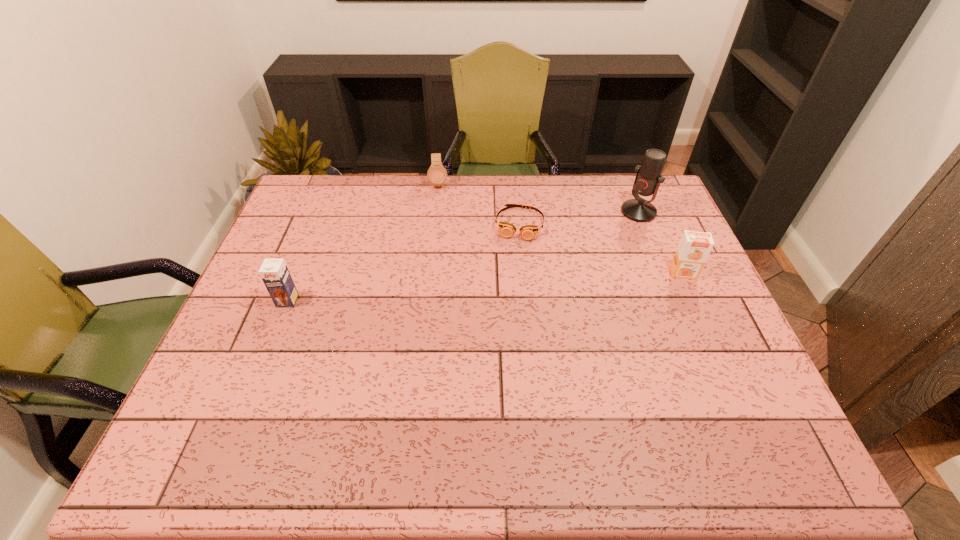
Where is `vacant space situated 0.230m on the side of the tallest object with the red ring`? The height and width of the screenshot is (540, 960). vacant space situated 0.230m on the side of the tallest object with the red ring is located at coordinates (583, 251).

The image size is (960, 540). Find the location of `free space located on the side of the tallest object with the red ring`. free space located on the side of the tallest object with the red ring is located at coordinates (570, 260).

I want to click on free space located on the side of the tallest object with the red ring, so click(606, 235).

At what (x,y) coordinates should I click in order to perform the action: click on vacant space located with the lenses facing forward on the shortest object. Please return your answer as a coordinate pair (x, y). The width and height of the screenshot is (960, 540). Looking at the image, I should click on (511, 274).

This screenshot has width=960, height=540. I want to click on vacant space located with the lenses facing forward on the shortest object, so click(x=514, y=258).

Where is `free space located 0.360m with the lenses facing forward on the shortest object`? This screenshot has height=540, width=960. free space located 0.360m with the lenses facing forward on the shortest object is located at coordinates (500, 335).

This screenshot has width=960, height=540. In order to click on vacant space located on the face of the fourth tallest object in this screenshot , I will do `click(440, 226)`.

The height and width of the screenshot is (540, 960). What are the coordinates of `free space located 0.210m on the face of the fourth tallest object` in the screenshot? It's located at (440, 230).

Find the location of a particular element. Image resolution: width=960 pixels, height=540 pixels. vacant area situated 0.310m on the face of the fourth tallest object is located at coordinates (441, 251).

Locate an element on the screen. This screenshot has width=960, height=540. microphone that is at the far edge is located at coordinates click(x=648, y=178).